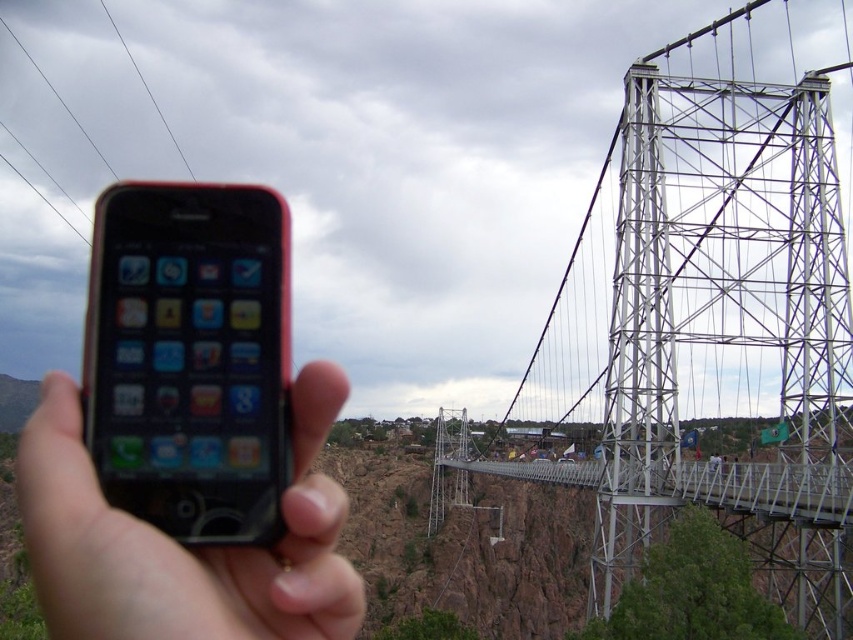
Question: Estimate the real-world distances between objects in this image. Which object is closer to the black wire at upper left?

Choices:
 (A) black matte smartphone at left
 (B) metallic wire at upper left
 (C) metallic silver suspension bridge at center

Answer: (B)

Question: Based on their relative distances, which object is nearer to the black matte smartphone at left?

Choices:
 (A) black wire at upper left
 (B) metallic silver suspension bridge at center
 (C) black matte phone at center

Answer: (C)

Question: Can you confirm if black matte smartphone at left is positioned to the left of black wire at upper left?

Choices:
 (A) yes
 (B) no

Answer: (B)

Question: Can you confirm if black matte smartphone at left is positioned below black matte phone at center?

Choices:
 (A) yes
 (B) no

Answer: (B)

Question: Can you confirm if metallic silver suspension bridge at center is wider than black matte smartphone at left?

Choices:
 (A) yes
 (B) no

Answer: (A)

Question: Which of the following is the closest to the observer?

Choices:
 (A) black matte phone at center
 (B) black wire at upper left

Answer: (A)